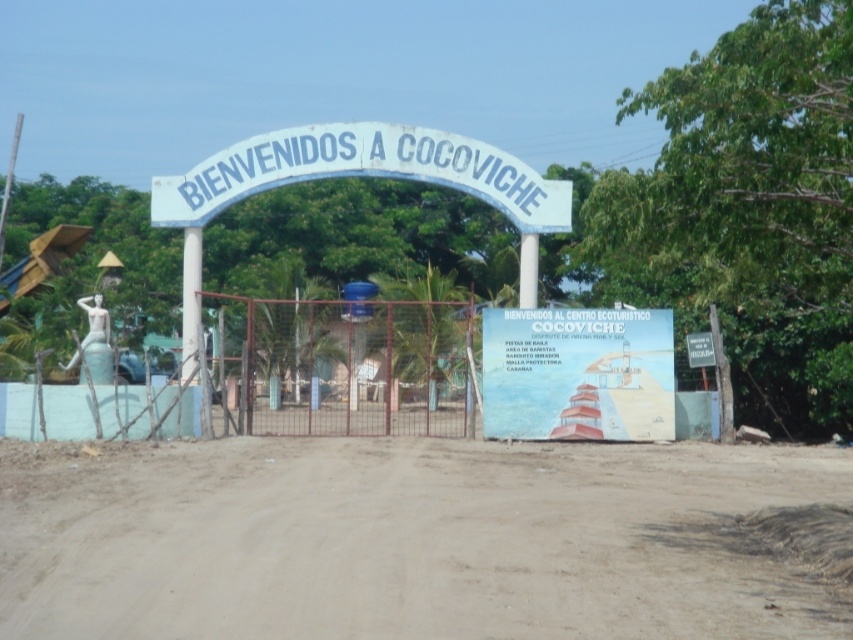
You are planning to drive a car through the entrance of Cocoviche. The car needs to stay on the brown sandy dirt track at center. Which direction should you look to find the white painted signboard at center?

The white painted signboard at center is located above the brown sandy dirt track at center, so you should look upward from the track to find the white painted signboard at center.

You are driving a car that is 4 meters long. You need to park your car on the brown sandy dirt track at center near the white painted wood sign at center. Is there enough space between the track and the sign to park your car?

The distance between the brown sandy dirt track at center and the white painted wood sign at center is 11.10 meters. Since your car is only 4 meters long, there is sufficient space to park your car near the sign.

You are standing at the entrance of Cocoviche and want to walk towards the gate. Which point, point (657,355) or point (305,164), is closer to you as you face the gate?

Point (657,355) is closer to the viewer than point (305,164), so you should head towards point (657,355) to reach the gate more quickly.